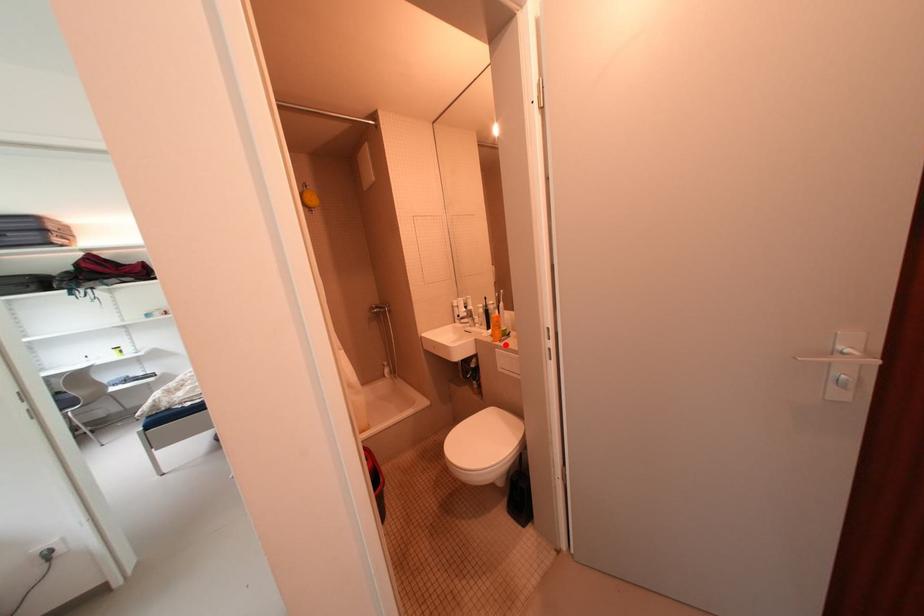
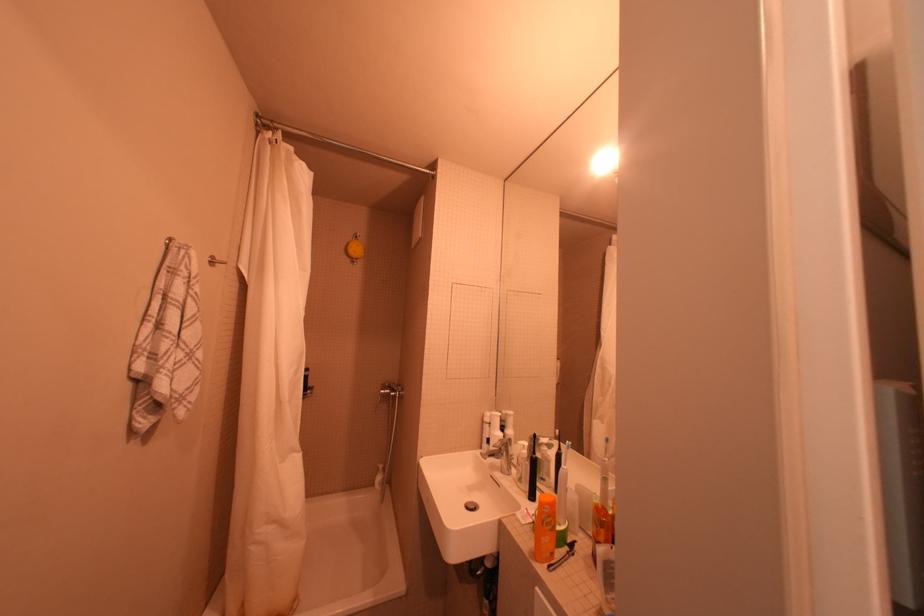
In the second image, find the point that corresponds to the highlighted location in the first image.

(551, 570)